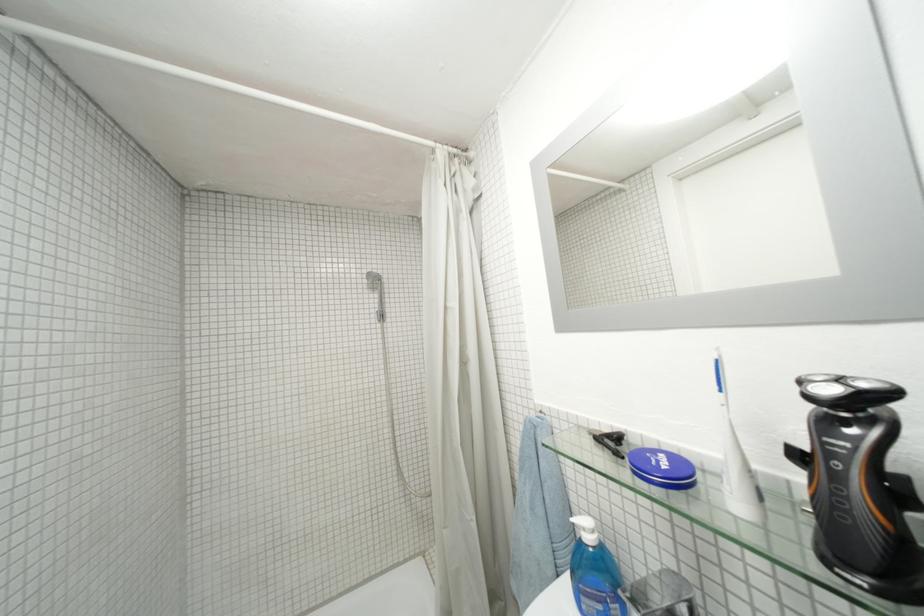
Where would you press the razor power button? Please return your answer as a coordinate pair (x, y).

(834, 463)